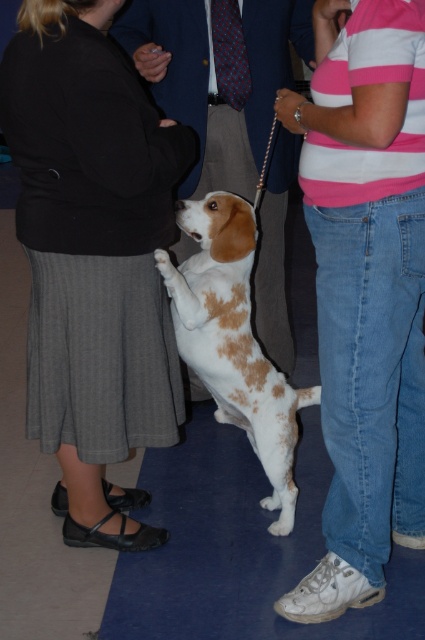
Question: Is pink striped shirt at upper right positioned before white fur dog at center?

Choices:
 (A) no
 (B) yes

Answer: (B)

Question: Which point is closer to the camera?

Choices:
 (A) (291, 35)
 (B) (34, 36)
 (C) (329, 26)

Answer: (B)

Question: Estimate the real-world distances between objects in this image. Which object is closer to the white fur dog at center?

Choices:
 (A) pink striped shirt at upper right
 (B) spotted fur dog at center
 (C) matte black jacket at center

Answer: (B)

Question: Estimate the real-world distances between objects in this image. Which object is farther from the matte black jacket at center?

Choices:
 (A) white fur dog at center
 (B) pink striped shirt at upper right
 (C) spotted fur dog at center

Answer: (A)

Question: Is white fur dog at center above spotted fur dog at center?

Choices:
 (A) yes
 (B) no

Answer: (A)

Question: Is matte black jacket at center further to the viewer compared to pink striped shirt at upper right?

Choices:
 (A) no
 (B) yes

Answer: (B)